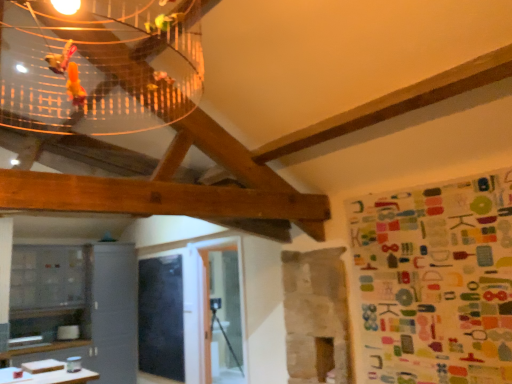
What is the approximate height of multicolored fabric at right?

The height of multicolored fabric at right is 4.08 feet.

The image size is (512, 384). What do you see at coordinates (436, 281) in the screenshot? I see `multicolored fabric at right` at bounding box center [436, 281].

Measure the distance between point (366, 300) and camera.

Point (366, 300) is 2.84 meters away from camera.

Identify the location of multicolored fabric at right. The height and width of the screenshot is (384, 512). (436, 281).

The image size is (512, 384). Describe the element at coordinates (161, 317) in the screenshot. I see `black matte board at center` at that location.

Locate an element on the screen. black matte board at center is located at coordinates (161, 317).

You are a GUI agent. You are given a task and a screenshot of the screen. Output one action in this format:
    pyautogui.click(x=<x>, y=<y>)
    Task: Click on the multicolored fabric at right
    The image size is (512, 384).
    Given the screenshot: What is the action you would take?
    pyautogui.click(x=436, y=281)

Based on their positions, is multicolored fabric at right located to the left or right of black matte board at center?

Based on their positions, multicolored fabric at right is located to the right of black matte board at center.

Does multicolored fabric at right lie in front of black matte board at center?

That is True.

Considering the positions of point (435, 217) and point (147, 341), is point (435, 217) closer or farther from the camera than point (147, 341)?

Clearly, point (435, 217) is closer to the camera than point (147, 341).

From the image's perspective, is multicolored fabric at right located beneath black matte board at center?

No.

From a real-world perspective, between multicolored fabric at right and black matte board at center, who is vertically lower?

black matte board at center.

Which of these two, multicolored fabric at right or black matte board at center, is wider?

Wider between the two is multicolored fabric at right.

Considering the relative sizes of multicolored fabric at right and black matte board at center in the image provided, is multicolored fabric at right taller than black matte board at center?

No.

Who is smaller, multicolored fabric at right or black matte board at center?

multicolored fabric at right.

Is multicolored fabric at right positioned beyond the bounds of black matte board at center?

Indeed, multicolored fabric at right is completely outside black matte board at center.

Is multicolored fabric at right next to black matte board at center and touching it?

No, multicolored fabric at right is not touching black matte board at center.

Is multicolored fabric at right positioned with its back to black matte board at center?

That's not correct — multicolored fabric at right is not looking away from black matte board at center.

There is a black matte board at center. Identify the location of wrapping paper above it (from a real-world perspective). This screenshot has width=512, height=384. (436, 281).

Is black matte board at center at the left side of multicolored fabric at right?

Indeed, black matte board at center is positioned on the left side of multicolored fabric at right.

In the scene shown: Which object is closer to the camera, black matte board at center or multicolored fabric at right?

Positioned in front is multicolored fabric at right.

Does point (138, 284) lie in front of point (358, 228)?

No, (138, 284) is further to viewer.

Looking at this image, from the image's perspective, is black matte board at center positioned above or below multicolored fabric at right?

black matte board at center is below multicolored fabric at right.

From a real-world perspective, is black matte board at center on top of multicolored fabric at right?

No, from a real-world perspective, black matte board at center is not on top of multicolored fabric at right.

Which of these two, black matte board at center or multicolored fabric at right, is thinner?

Thinner between the two is black matte board at center.

In terms of height, does black matte board at center look taller or shorter compared to multicolored fabric at right?

black matte board at center is taller than multicolored fabric at right.

Which of these two, black matte board at center or multicolored fabric at right, is smaller?

multicolored fabric at right.

Is multicolored fabric at right completely or partially inside black matte board at center?

No, multicolored fabric at right is not inside black matte board at center.

Does black matte board at center touch multicolored fabric at right?

No, black matte board at center is not making contact with multicolored fabric at right.

Is black matte board at center aimed at multicolored fabric at right?

No, black matte board at center is not oriented towards multicolored fabric at right.

What's the angular difference between black matte board at center and multicolored fabric at right's facing directions?

0.126 degrees.

How far apart are black matte board at center and multicolored fabric at right?

black matte board at center is 3.44 meters from multicolored fabric at right.

The height and width of the screenshot is (384, 512). I want to click on bulletin board located on the left of multicolored fabric at right, so click(161, 317).

Locate an element on the screen. wrapping paper that is in front of the black matte board at center is located at coordinates (436, 281).

The height and width of the screenshot is (384, 512). Identify the location of bulletin board on the left of multicolored fabric at right. (161, 317).